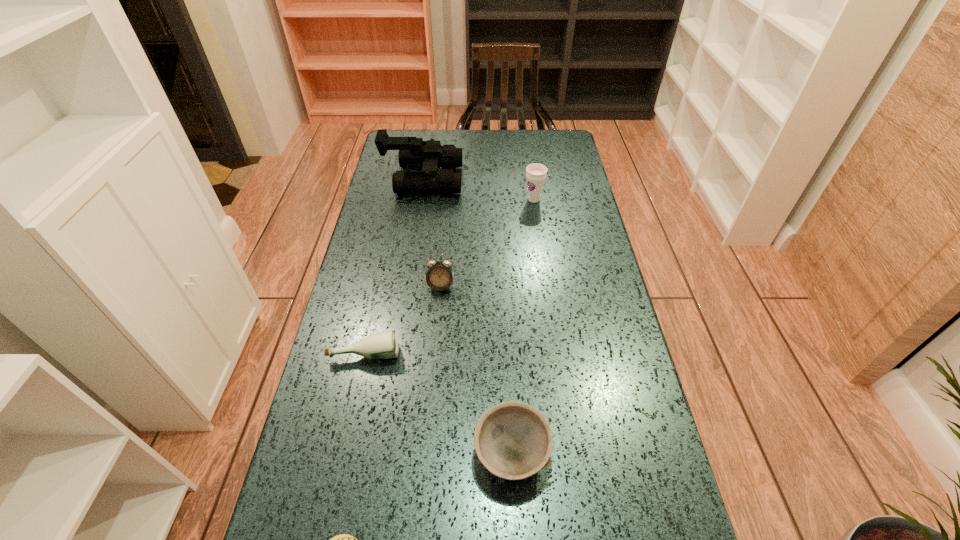
In the image, there is a desktop. At what (x,y) coordinates should I click in order to perform the action: click on vacant space at the far right corner. Please return your answer as a coordinate pair (x, y). Looking at the image, I should click on (556, 159).

The image size is (960, 540). I want to click on unoccupied position between the fifth tallest object and the third tallest object, so click(x=403, y=319).

At what (x,y) coordinates should I click in order to perform the action: click on vacant area that lies between the fifth farthest object and the second shortest object. Please return your answer as a coordinate pair (x, y). This screenshot has width=960, height=540. Looking at the image, I should click on (439, 403).

Where is `vacant space that is in between the fourth shortest object and the second nearest object`? Image resolution: width=960 pixels, height=540 pixels. vacant space that is in between the fourth shortest object and the second nearest object is located at coordinates (476, 370).

Locate which object ranks in proximity to the bottle. Please provide its 2D coordinates. Your answer should be formatted as a tuple, i.e. [(x, y)], where the tuple contains the x and y coordinates of a point satisfying the conditions above.

[(439, 276)]

Choose which object is the fifth nearest neighbor to the second shortest object. Please provide its 2D coordinates. Your answer should be formatted as a tuple, i.e. [(x, y)], where the tuple contains the x and y coordinates of a point satisfying the conditions above.

[(536, 173)]

Where is `vacant space that satisfies the following two spatial constraints: 1. on the front lenses of the binoculars; 2. on the left side of the cup`? Image resolution: width=960 pixels, height=540 pixels. vacant space that satisfies the following two spatial constraints: 1. on the front lenses of the binoculars; 2. on the left side of the cup is located at coordinates (420, 199).

Find the location of `free space in the image that satisfies the following two spatial constraints: 1. on the front lenses of the binoculars; 2. on the right side of the rightmost object`. free space in the image that satisfies the following two spatial constraints: 1. on the front lenses of the binoculars; 2. on the right side of the rightmost object is located at coordinates (420, 199).